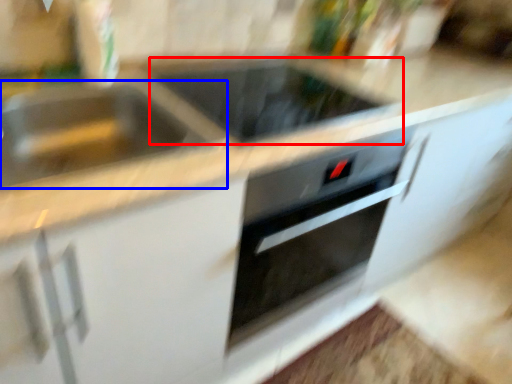
Question: Which object appears farthest to the camera in this image, appliance (highlighted by a red box) or sink (highlighted by a blue box)?

Choices:
 (A) appliance
 (B) sink

Answer: (A)